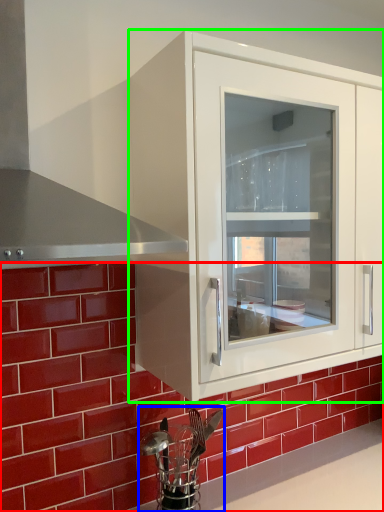
Question: Which object is the farthest from brick (highlighted by a red box)? Choose among these: appliance (highlighted by a blue box) or cabinetry (highlighted by a green box).

Choices:
 (A) appliance
 (B) cabinetry

Answer: (B)